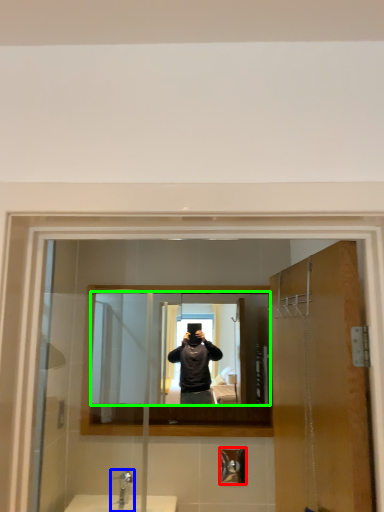
Question: Which object is positioned closest to shower (highlighted by a red box)? Select from tap (highlighted by a blue box) and mirror (highlighted by a green box).

Choices:
 (A) tap
 (B) mirror

Answer: (A)